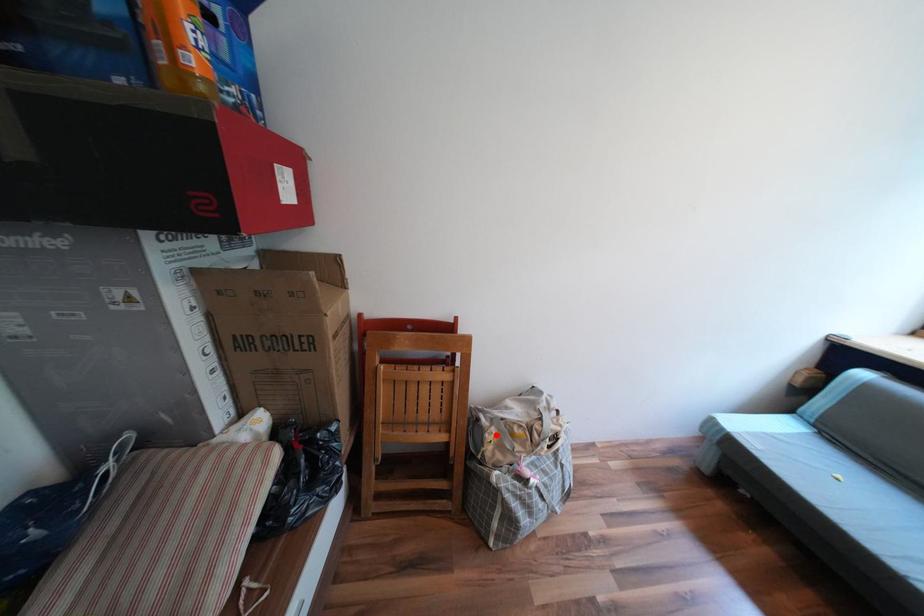
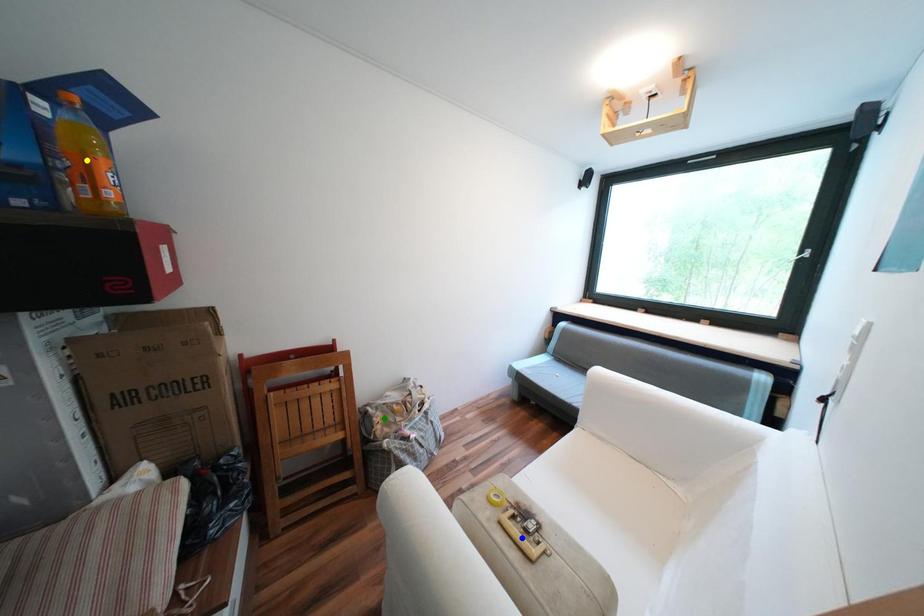
Question: I am providing you with two images of the same scene from different viewpoints. A red point is marked on the first image. You are given multiple points on the second image. Can you choose the point in image 2 that corresponds to the point in image 1?

Choices:
 (A) green point
 (B) yellow point
 (C) blue point

Answer: (A)